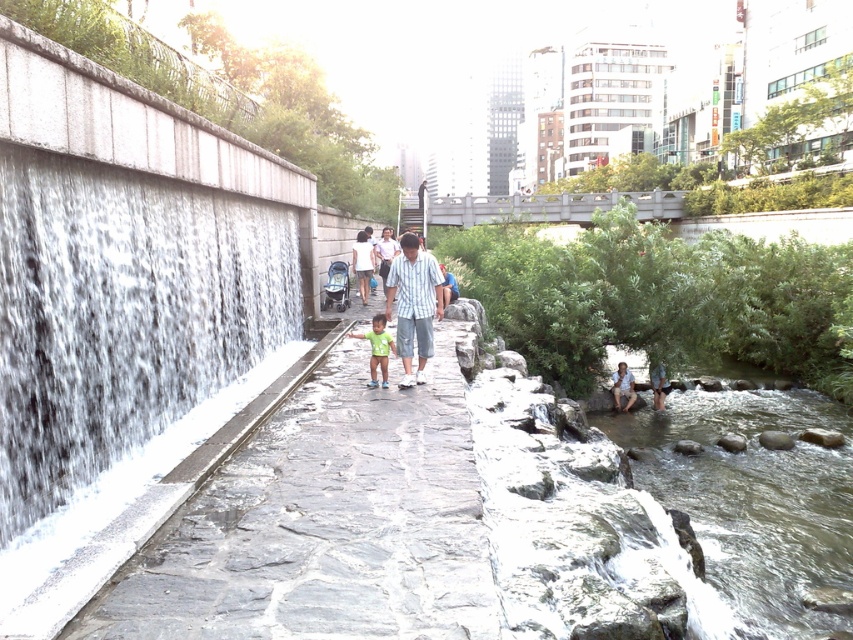
Find the location of a particular element. This screenshot has width=853, height=640. gray stone path at center is located at coordinates (323, 524).

Is point (312, 636) positioned behind point (380, 349)?

That is False.

Image resolution: width=853 pixels, height=640 pixels. What are the coordinates of `gray stone path at center` in the screenshot? It's located at (323, 524).

Between point (656, 420) and point (421, 381), which one is positioned in front?

Positioned in front is point (421, 381).

Who is higher up, clear water at stream right or striped cotton shirt at center?

striped cotton shirt at center is above.

Which is in front, point (694, 490) or point (404, 346)?

Point (404, 346)

At what (x,y) coordinates should I click in order to perform the action: click on clear water at stream right. Please return your answer as a coordinate pair (x, y). Looking at the image, I should click on (750, 502).

Does gray stone path at center appear under clear water at stream right?

Actually, gray stone path at center is above clear water at stream right.

The width and height of the screenshot is (853, 640). Find the location of `gray stone path at center`. gray stone path at center is located at coordinates (323, 524).

Which is in front, point (380, 490) or point (775, 561)?

Point (380, 490) is in front.

Locate an element on the screen. gray stone path at center is located at coordinates (323, 524).